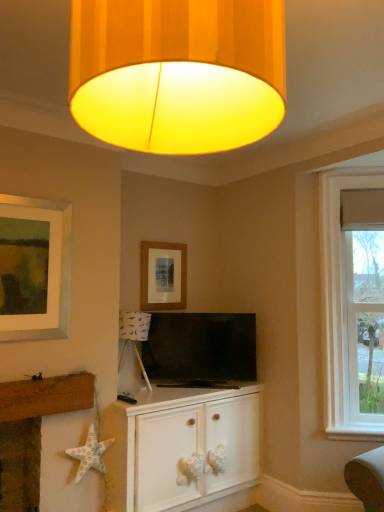
Question: Based on their positions, is clear glass window at right located to the left or right of white wood cabinet at center?

Choices:
 (A) left
 (B) right

Answer: (B)

Question: From the image's perspective, is clear glass window at right located above or below white wood cabinet at center?

Choices:
 (A) below
 (B) above

Answer: (B)

Question: Estimate the real-world distances between objects in this image. Which object is closer to the black glossy flat-screen tv at center?

Choices:
 (A) white fabric starfish at lower left
 (B) clear glass window at right
 (C) matte wooden picture frame at upper center
 (D) white paper starfish at lower left
 (E) yellow fabric lampshade at upper center

Answer: (C)

Question: Estimate the real-world distances between objects in this image. Which object is farther from the black glossy flat-screen tv at center?

Choices:
 (A) white wood cabinet at center
 (B) white paper starfish at lower left
 (C) white fabric starfish at lower left
 (D) clear glass window at right
 (E) matte wooden picture frame at upper center

Answer: (C)